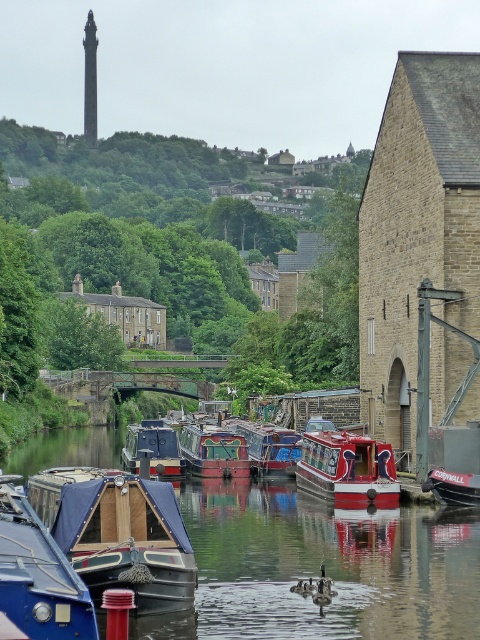
Can you confirm if smooth wooden boat at lower left is positioned to the right of matte blue boat at center?

Indeed, smooth wooden boat at lower left is positioned on the right side of matte blue boat at center.

Is point (120, 432) closer to camera compared to point (129, 464)?

No, it is behind (129, 464).

Is point (405, 529) closer to camera compared to point (158, 444)?

Yes, it is in front of point (158, 444).

The width and height of the screenshot is (480, 640). I want to click on smooth wooden boat at lower left, so click(325, 568).

Does wooden polished boat at center have a larger size compared to matte blue boat at center?

No.

Is point (197, 448) more distant than point (128, 442)?

No, it is not.

Identify the location of wooden polished boat at center. The width and height of the screenshot is (480, 640). (214, 451).

Is point (216, 476) farther from viewer compared to point (445, 488)?

Yes, it is.

Can you confirm if wooden polished boat at center is smaller than red polished wood boat at lower right?

Actually, wooden polished boat at center might be larger than red polished wood boat at lower right.

Between point (235, 474) and point (459, 481), which one is positioned in front?

Positioned in front is point (459, 481).

This screenshot has height=640, width=480. I want to click on wooden polished boat at center, so click(214, 451).